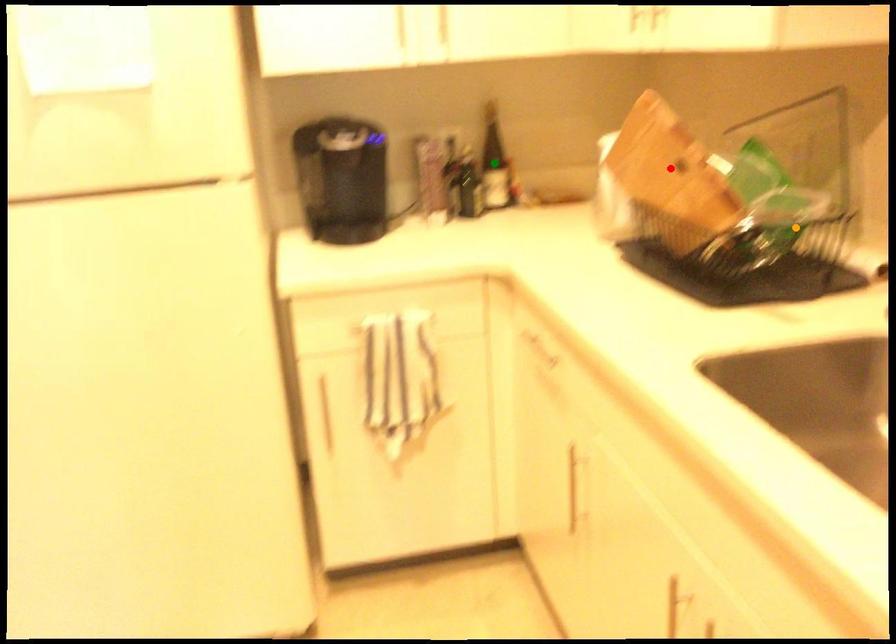
Order these from nearest to farthest:
orange point, red point, green point

red point
orange point
green point